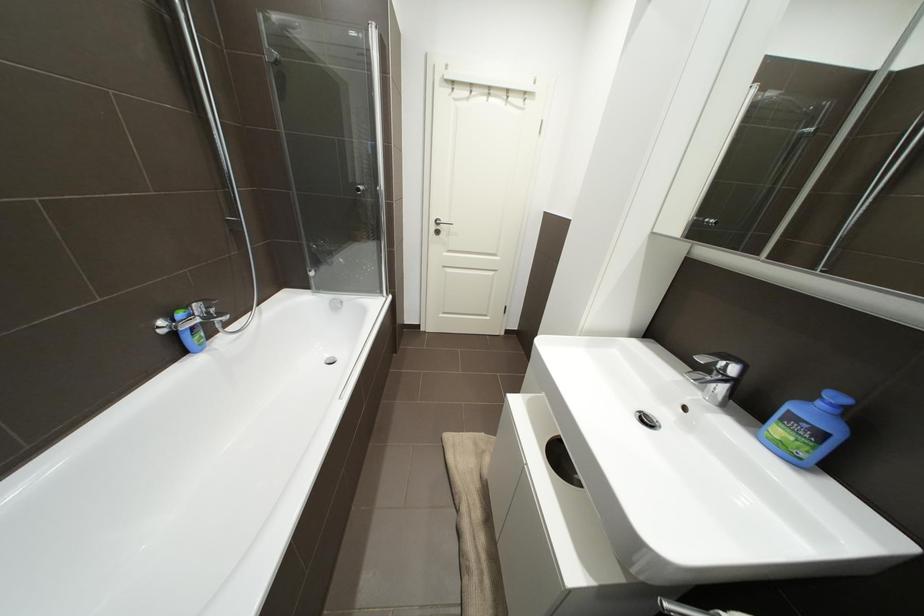
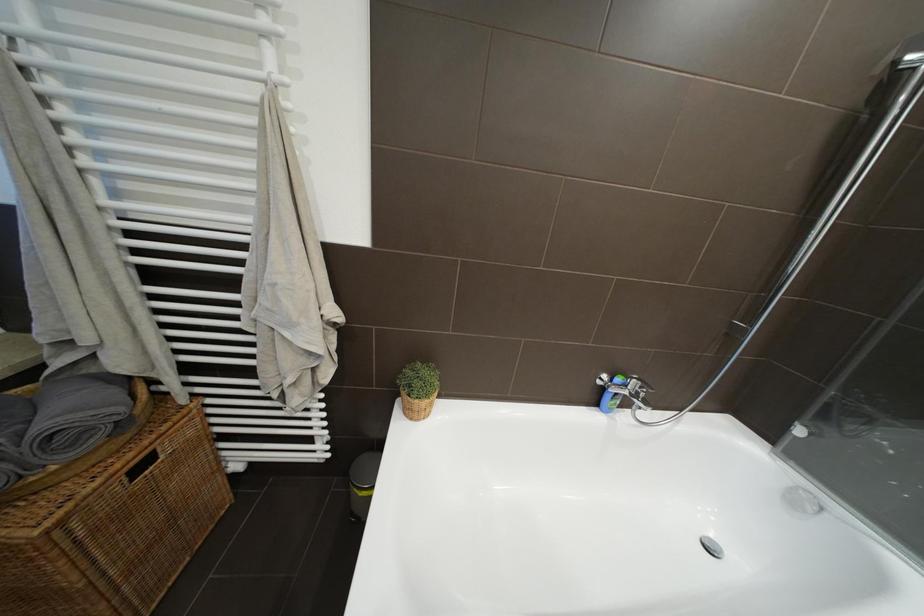
Question: The camera is either moving clockwise (left) or counter-clockwise (right) around the object. The first image is from the beginning of the video and the second image is from the end. Is the camera moving left or right when shooting the video?

Choices:
 (A) Left
 (B) Right

Answer: (B)